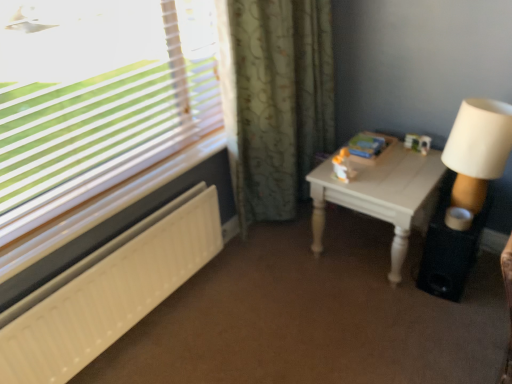
Question: Is white textured radiator at lower left far away from white wood table at right?

Choices:
 (A) no
 (B) yes

Answer: (A)

Question: Does white textured radiator at lower left appear on the right side of white wood table at right?

Choices:
 (A) no
 (B) yes

Answer: (A)

Question: Is white textured radiator at lower left aimed at white wood table at right?

Choices:
 (A) yes
 (B) no

Answer: (B)

Question: Is white textured radiator at lower left outside of white wood table at right?

Choices:
 (A) yes
 (B) no

Answer: (A)

Question: From the image's perspective, would you say white textured radiator at lower left is shown under white wood table at right?

Choices:
 (A) no
 (B) yes

Answer: (B)

Question: From a real-world perspective, is white textured radiator at lower left physically located above or below green floral fabric curtain at center?

Choices:
 (A) below
 (B) above

Answer: (A)

Question: Does point (148, 256) appear closer or farther from the camera than point (324, 49)?

Choices:
 (A) farther
 (B) closer

Answer: (B)

Question: From the image's perspective, is white textured radiator at lower left positioned above or below green floral fabric curtain at center?

Choices:
 (A) below
 (B) above

Answer: (A)

Question: Considering the positions of white textured radiator at lower left and green floral fabric curtain at center in the image, is white textured radiator at lower left bigger or smaller than green floral fabric curtain at center?

Choices:
 (A) big
 (B) small

Answer: (B)

Question: In terms of width, does green floral fabric curtain at center look wider or thinner when compared to white textured radiator at lower left?

Choices:
 (A) wide
 (B) thin

Answer: (A)

Question: From the image's perspective, relative to white textured radiator at lower left, is green floral fabric curtain at center above or below?

Choices:
 (A) above
 (B) below

Answer: (A)

Question: From a real-world perspective, is green floral fabric curtain at center positioned above or below white textured radiator at lower left?

Choices:
 (A) below
 (B) above

Answer: (B)

Question: In the image, is green floral fabric curtain at center positioned in front of or behind white textured radiator at lower left?

Choices:
 (A) behind
 (B) front

Answer: (A)

Question: Considering the positions of point (132, 226) and point (444, 183), is point (132, 226) closer or farther from the camera than point (444, 183)?

Choices:
 (A) closer
 (B) farther

Answer: (A)

Question: Considering the positions of white textured radiator at lower left and black matte speaker at lower right in the image, is white textured radiator at lower left bigger or smaller than black matte speaker at lower right?

Choices:
 (A) small
 (B) big

Answer: (B)